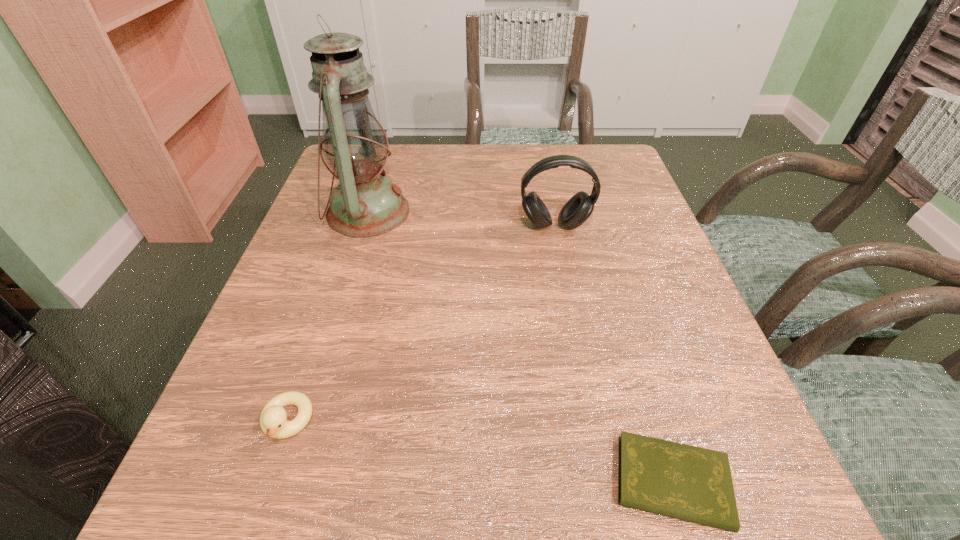
The image size is (960, 540). I want to click on vacant space at the far right corner, so coord(596,154).

In the image, there is a desktop. Where is `vacant region at the near right corner`? Image resolution: width=960 pixels, height=540 pixels. vacant region at the near right corner is located at coordinates (731, 536).

At what (x,y) coordinates should I click in order to perform the action: click on free space between the diary and the tallest object. Please return your answer as a coordinate pair (x, y). Image resolution: width=960 pixels, height=540 pixels. Looking at the image, I should click on (520, 347).

Where is `unoccupied position between the diary and the oil lamp`? The width and height of the screenshot is (960, 540). unoccupied position between the diary and the oil lamp is located at coordinates (520, 347).

The width and height of the screenshot is (960, 540). What are the coordinates of `empty space between the oil lamp and the diary` in the screenshot? It's located at (520, 347).

At what (x,y) coordinates should I click in order to perform the action: click on vacant area between the oil lamp and the shortest object. Please return your answer as a coordinate pair (x, y). This screenshot has height=540, width=960. Looking at the image, I should click on (520, 347).

This screenshot has height=540, width=960. Identify the location of free space between the diary and the tallest object. click(520, 347).

I want to click on blank region between the third tallest object and the oil lamp, so click(327, 316).

Where is `free area in between the shortest object and the second shortest object`? Image resolution: width=960 pixels, height=540 pixels. free area in between the shortest object and the second shortest object is located at coordinates (480, 451).

Locate an element on the screen. free point between the oil lamp and the headset is located at coordinates point(462,219).